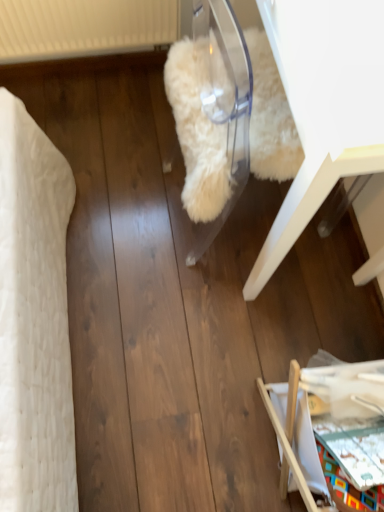
Identify the location of vacant space behind wooden folding chair at lower right, marked as the first furniture in a bottom-to-top arrangement. The height and width of the screenshot is (512, 384). (310, 309).